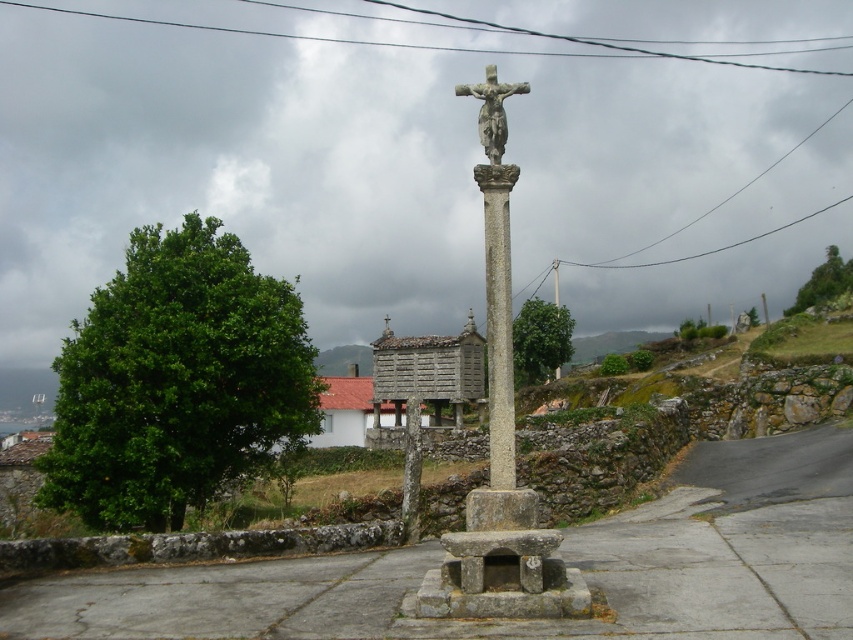
Question: Does stone crucifix at center appear on the left side of stone statue at center?

Choices:
 (A) no
 (B) yes

Answer: (B)

Question: Among these points, which one is farthest from the camera?

Choices:
 (A) (474, 177)
 (B) (485, 115)

Answer: (A)

Question: Which point appears closest to the camera in this image?

Choices:
 (A) (509, 390)
 (B) (415, 516)
 (C) (492, 83)
 (D) (496, 454)

Answer: (D)

Question: Which point is farther from the camera taking this photo?

Choices:
 (A) (490, 422)
 (B) (485, 138)
 (C) (405, 422)
 (D) (492, 192)

Answer: (C)

Question: Can you confirm if stone crucifix at center is positioned to the left of stone statue at center?

Choices:
 (A) yes
 (B) no

Answer: (A)

Question: Does stone crucifix at center appear on the right side of stone statue at center?

Choices:
 (A) no
 (B) yes

Answer: (A)